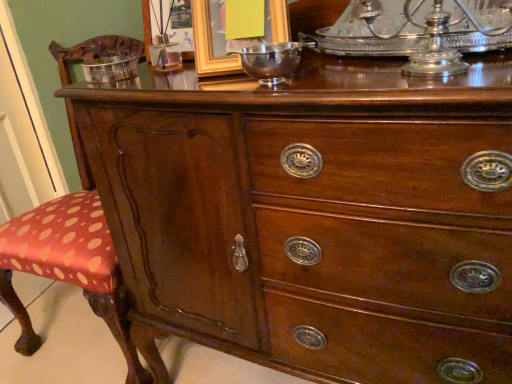
Identify the location of free space on the front side of shiny silver bowl at center. (296, 91).